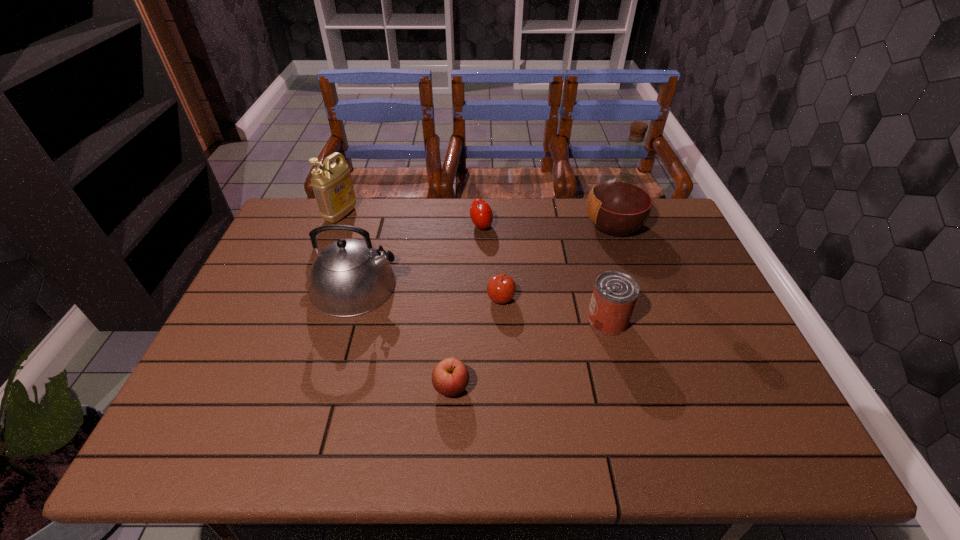
I want to click on vacant point that satisfies the following two spatial constraints: 1. on the front label of the tallest object; 2. on the front side of the nearest object, so click(x=672, y=387).

Identify the location of free location that satisfies the following two spatial constraints: 1. from the spout of the kettle; 2. on the back side of the fourth shortest object. (346, 320).

This screenshot has width=960, height=540. I want to click on free spot that satisfies the following two spatial constraints: 1. on the front side of the fourth tallest object; 2. on the right side of the farthest apple, so click(482, 320).